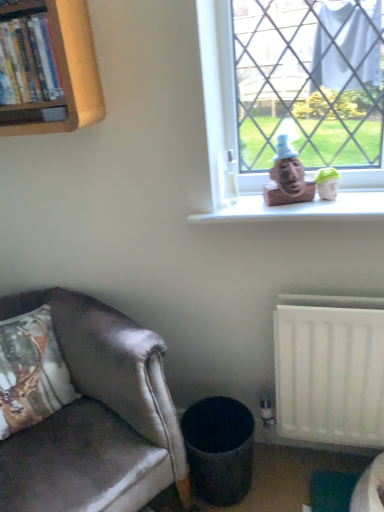
Question: From the image's perspective, is satin brown leather chair at lower left on top of textured gray trash can at lower center?

Choices:
 (A) yes
 (B) no

Answer: (A)

Question: Considering the relative positions of satin brown leather chair at lower left and textured gray trash can at lower center in the image provided, is satin brown leather chair at lower left to the right of textured gray trash can at lower center from the viewer's perspective?

Choices:
 (A) yes
 (B) no

Answer: (B)

Question: Considering the relative sizes of satin brown leather chair at lower left and textured gray trash can at lower center in the image provided, is satin brown leather chair at lower left smaller than textured gray trash can at lower center?

Choices:
 (A) yes
 (B) no

Answer: (B)

Question: Does satin brown leather chair at lower left have a greater width compared to textured gray trash can at lower center?

Choices:
 (A) yes
 (B) no

Answer: (A)

Question: Is satin brown leather chair at lower left bigger than textured gray trash can at lower center?

Choices:
 (A) yes
 (B) no

Answer: (A)

Question: From the image's perspective, relative to textured gray trash can at lower center, is matte brown bust at window above or below?

Choices:
 (A) below
 (B) above

Answer: (B)

Question: Based on their sizes in the image, would you say matte brown bust at window is bigger or smaller than textured gray trash can at lower center?

Choices:
 (A) small
 (B) big

Answer: (A)

Question: Is matte brown bust at window taller or shorter than textured gray trash can at lower center?

Choices:
 (A) short
 (B) tall

Answer: (A)

Question: Is matte brown bust at window wider or thinner than textured gray trash can at lower center?

Choices:
 (A) thin
 (B) wide

Answer: (A)

Question: Visually, is wooden bookshelf at upper left positioned to the left or to the right of matte brown bust at window?

Choices:
 (A) right
 (B) left

Answer: (B)

Question: Is wooden bookshelf at upper left taller or shorter than matte brown bust at window?

Choices:
 (A) tall
 (B) short

Answer: (B)

Question: Does point (21, 124) appear closer or farther from the camera than point (286, 165)?

Choices:
 (A) closer
 (B) farther

Answer: (A)

Question: Looking at the image, does wooden bookshelf at upper left seem bigger or smaller compared to matte brown bust at window?

Choices:
 (A) small
 (B) big

Answer: (B)

Question: From the image's perspective, relative to green fabric toy at upper right, is matte brown bust at window above or below?

Choices:
 (A) below
 (B) above

Answer: (B)

Question: Is matte brown bust at window inside or outside of green fabric toy at upper right?

Choices:
 (A) outside
 (B) inside

Answer: (A)